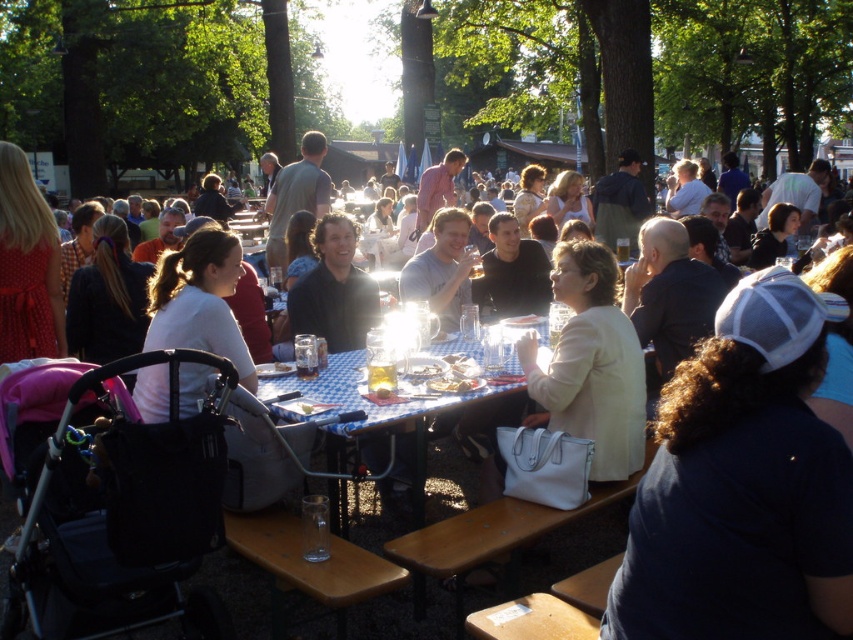
Does dark blue t-shirt at center appear over blue checkered tablecloth at center?

Yes, dark blue t-shirt at center is above blue checkered tablecloth at center.

Who is shorter, dark blue t-shirt at center or blue checkered tablecloth at center?

blue checkered tablecloth at center

Between point (746, 500) and point (519, 376), which one is positioned in front?

Point (746, 500)

Find the location of a particular element. dark blue t-shirt at center is located at coordinates (741, 484).